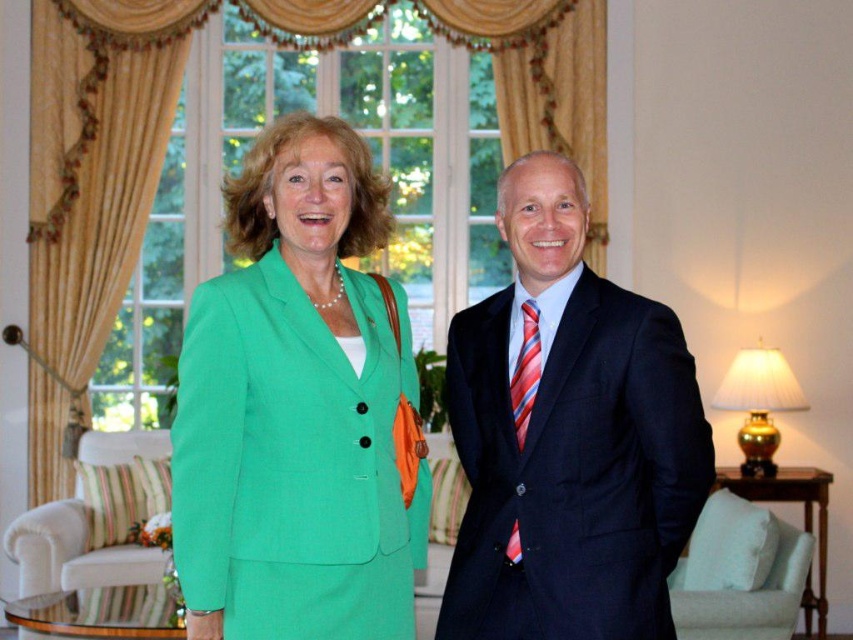
Question: Does green fabric suit at left have a larger size compared to striped fabric tie at center?

Choices:
 (A) no
 (B) yes

Answer: (B)

Question: Based on their relative distances, which object is nearer to the green fabric suit at left?

Choices:
 (A) striped fabric tie at center
 (B) green fabric suit at center
 (C) navy blue suit at center

Answer: (B)

Question: Which of the following is the closest to the observer?

Choices:
 (A) green fabric suit at left
 (B) striped fabric tie at center
 (C) green fabric suit at center
 (D) navy blue suit at center

Answer: (A)

Question: Can you confirm if green fabric suit at center is positioned to the right of striped fabric tie at center?

Choices:
 (A) yes
 (B) no

Answer: (B)

Question: From the image, what is the correct spatial relationship of green fabric suit at left in relation to striped fabric tie at center?

Choices:
 (A) left
 (B) right

Answer: (A)

Question: Which is farther from the green fabric suit at left?

Choices:
 (A) green fabric suit at center
 (B) striped fabric tie at center
 (C) navy blue suit at center

Answer: (B)